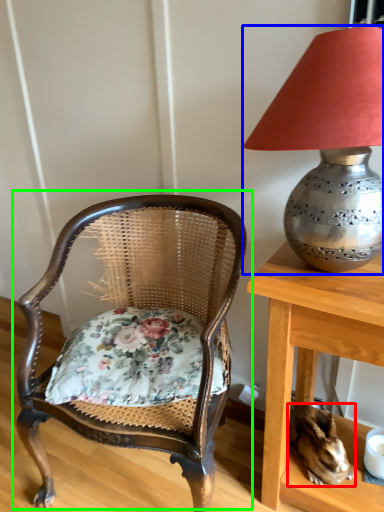
Question: Considering the real-world distances, which object is farthest from rabbit (highlighted by a red box)? lamp (highlighted by a blue box) or chair (highlighted by a green box)?

Choices:
 (A) lamp
 (B) chair

Answer: (A)